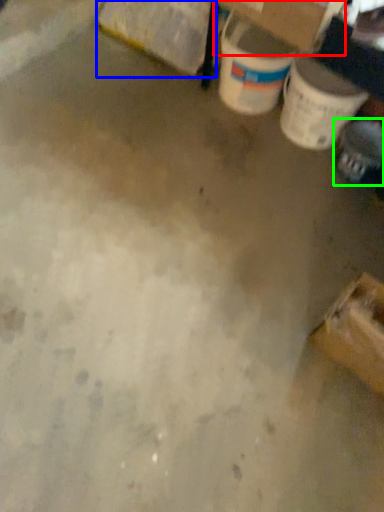
Question: Estimate the real-world distances between objects in this image. Which object is farther from cardboard box (highlighted by a red box), cardboard box (highlighted by a blue box) or footwear (highlighted by a green box)?

Choices:
 (A) cardboard box
 (B) footwear

Answer: (B)